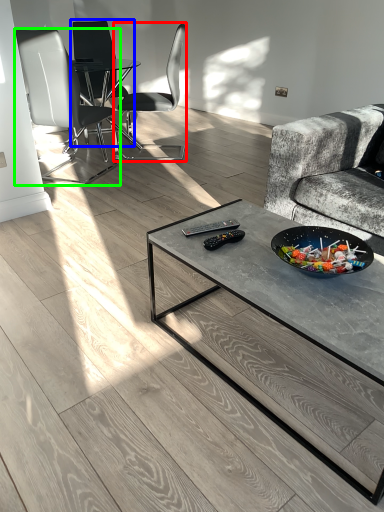
Question: Based on their relative distances, which object is farther from chair (highlighted by a red box)? Choose from chair (highlighted by a blue box) and chair (highlighted by a green box).

Choices:
 (A) chair
 (B) chair

Answer: (B)